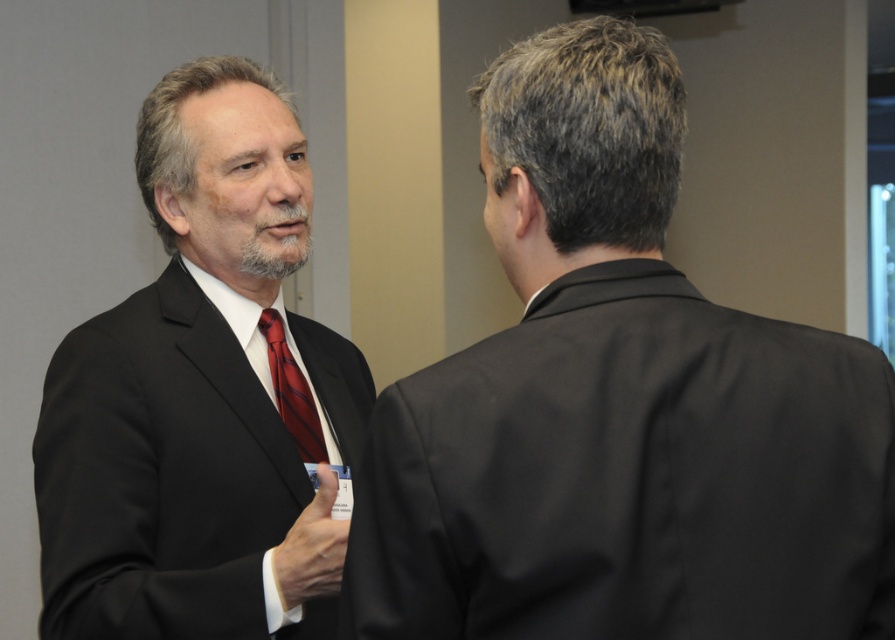
You are a tailor measuring the distance between the matte black suit at left and the shiny silk tie at left for a custom alteration. Can you fit a 6.5 inch long pin between them?

The matte black suit at left is 6.94 inches away from the shiny silk tie at left, so yes, a 6.5 inch long pin can fit between them since the distance is greater than the pin length.

You are a photographer positioned in front of the two people in the image. You want to take a closeup shot of the shiny silk tie at left without including the matte black suit at left in the frame. Is this possible given their positions?

The matte black suit at left is closer to the viewer than the shiny silk tie at left, so taking a closeup of the shiny silk tie at left without including the matte black suit at left would not be possible because the suit is in front of the tie.

You are standing in a room where two people are talking. You notice two points marked on the floor at coordinates point (749,508) and point (273,369). If you were to walk from the point closer to you towards the farther one, which coordinate would you end at?

Point (273,369) is farther away from you than point (749,508). So if you walk from the closer point (749,508) towards the farther one, you would end at point (273,369).